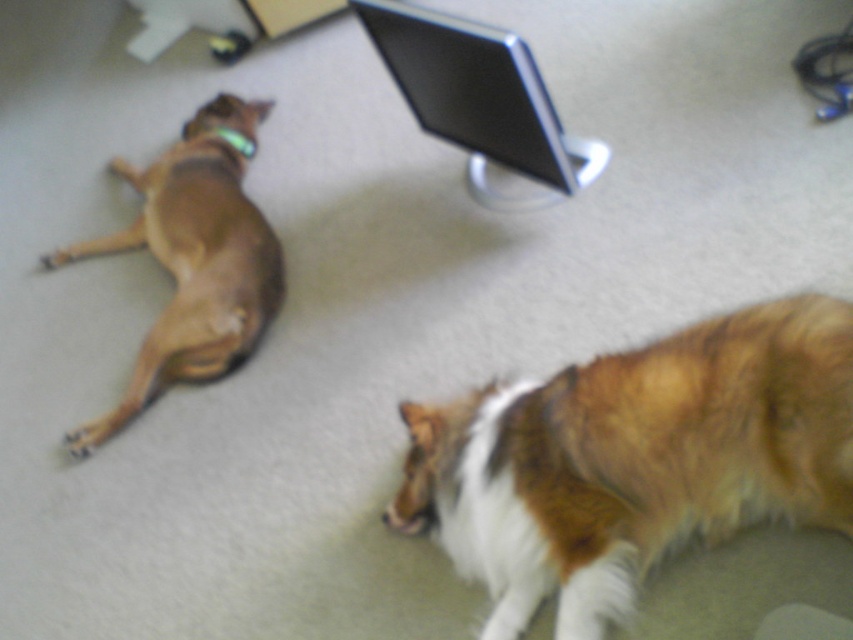
You are a photographer standing 2 meters away from the camera. You want to take a photo of the brown matte dog at left. Will you be able to reach the dog without moving the camera?

The brown matte dog at left is 1.97 meters from camera, so yes, you can reach the dog without moving the camera since you are standing 2 meters away, which is slightly farther than the dog.

You are a dog trainer who needs to place a divider between two dogs to prevent them from interacting. The divider you have is 36 inches wide. Based on the image, will the divider fit between the brown fluffy dog at lower right and the brown matte dog at left?

The distance between the brown fluffy dog at lower right and the brown matte dog at left is 36.90 inches. Since the divider is 36 inches wide, it will fit between them as there is enough space.

You are trying to take a photo of the brown fluffy dog at lower right without the black glossy monitor at upper center appearing in the frame. Based on their positions, can you position yourself so that the monitor is out of sight while still capturing the dog?

The brown fluffy dog at lower right is closer to the viewer than the black glossy monitor at upper center. By positioning yourself lower and closer to the dog, you can block the view of the monitor while still capturing the dog in the frame.